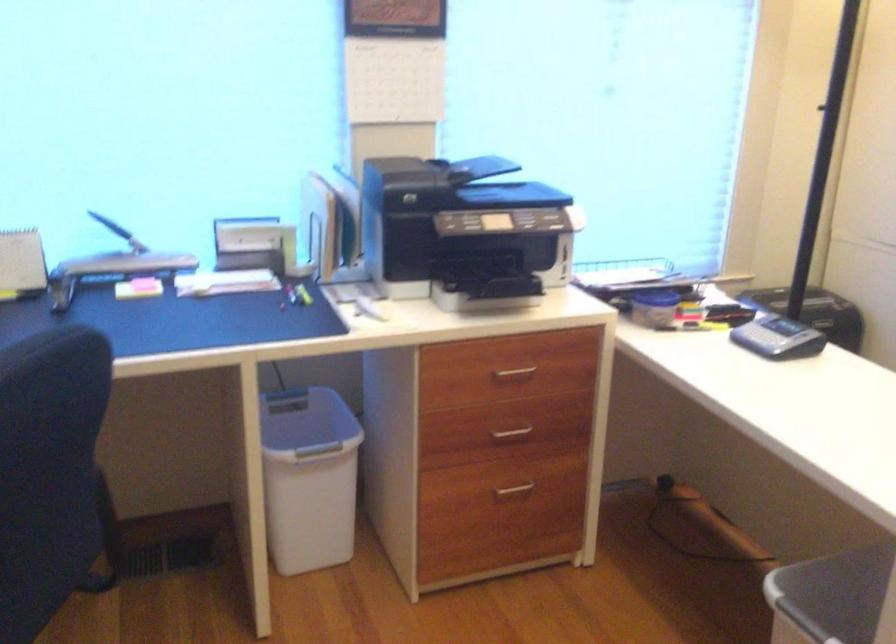
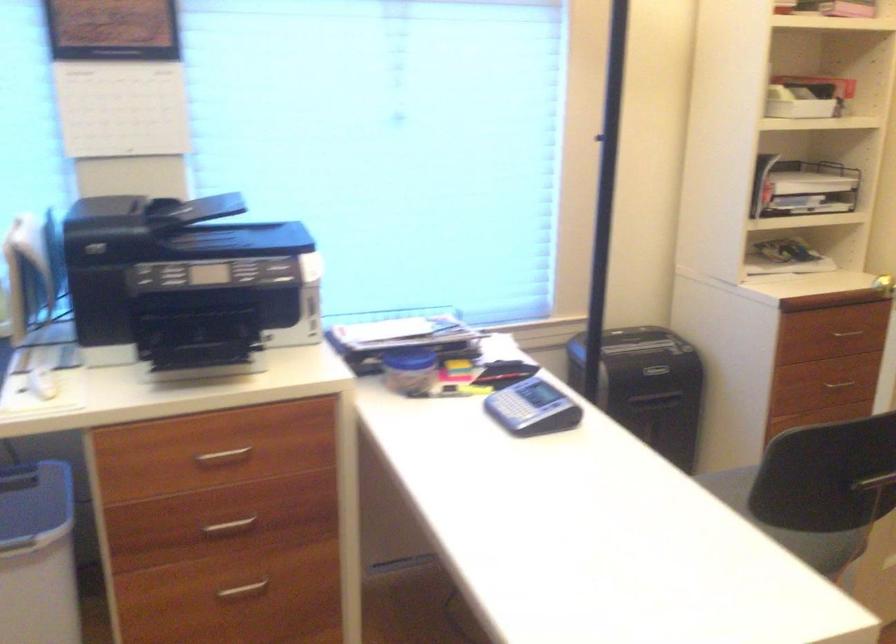
The point at (x=512, y=374) is marked in the first image. Where is the corresponding point in the second image?

(222, 457)